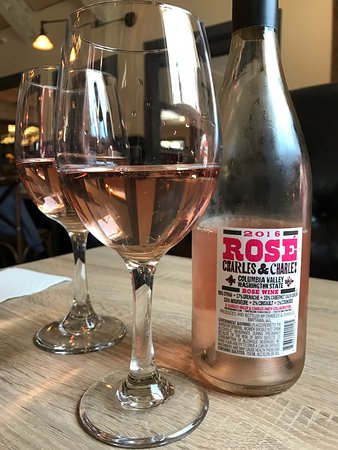
Where is `wine glass stem`? The width and height of the screenshot is (338, 450). wine glass stem is located at coordinates (139, 312), (81, 273).